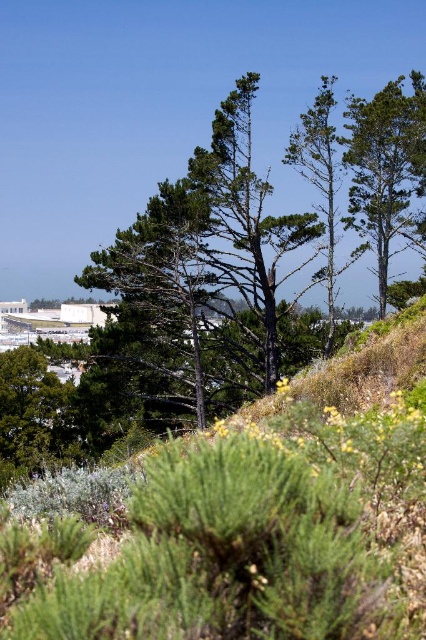
Between green matte tree at upper right and green matte tree at center, which one has less height?

green matte tree at center

Does green matte tree at upper right have a greater height compared to green matte tree at center?

Indeed, green matte tree at upper right has a greater height compared to green matte tree at center.

At what (x,y) coordinates should I click in order to perform the action: click on green matte tree at upper right. Please return your answer as a coordinate pair (x, y). The width and height of the screenshot is (426, 640). Looking at the image, I should click on (385, 164).

This screenshot has height=640, width=426. What are the coordinates of `green matte tree at upper right` in the screenshot? It's located at (385, 164).